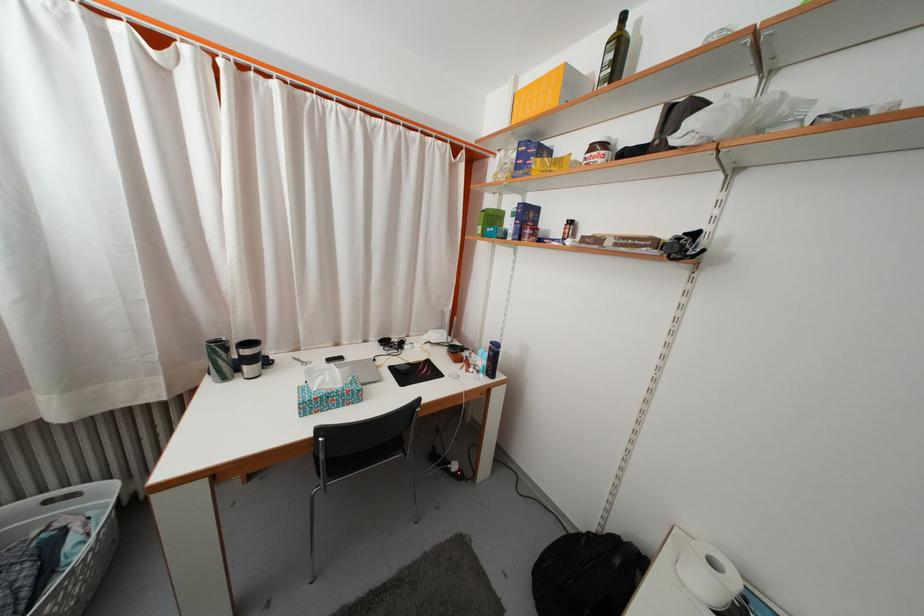
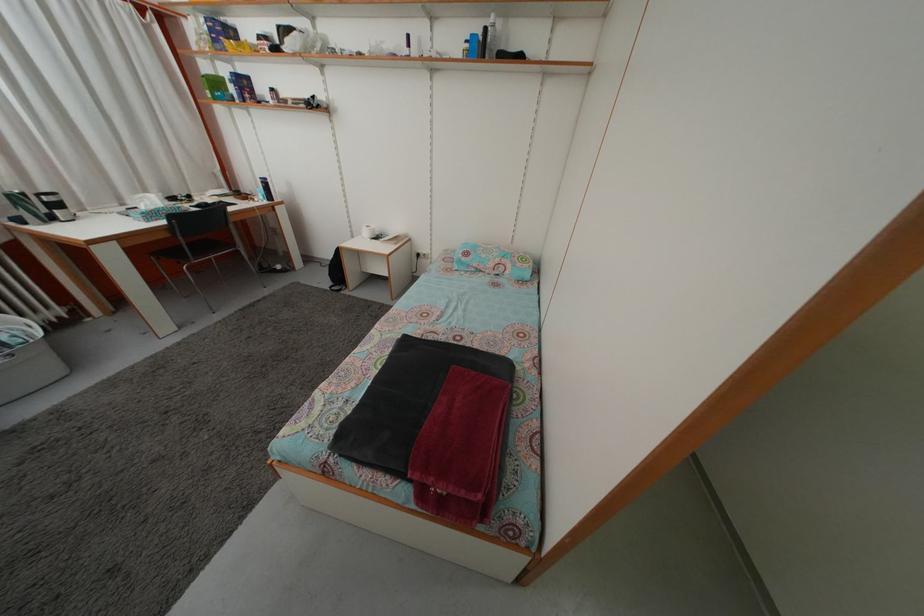
The point at [343,352] is marked in the first image. Where is the corresponding point in the second image?

(128, 213)